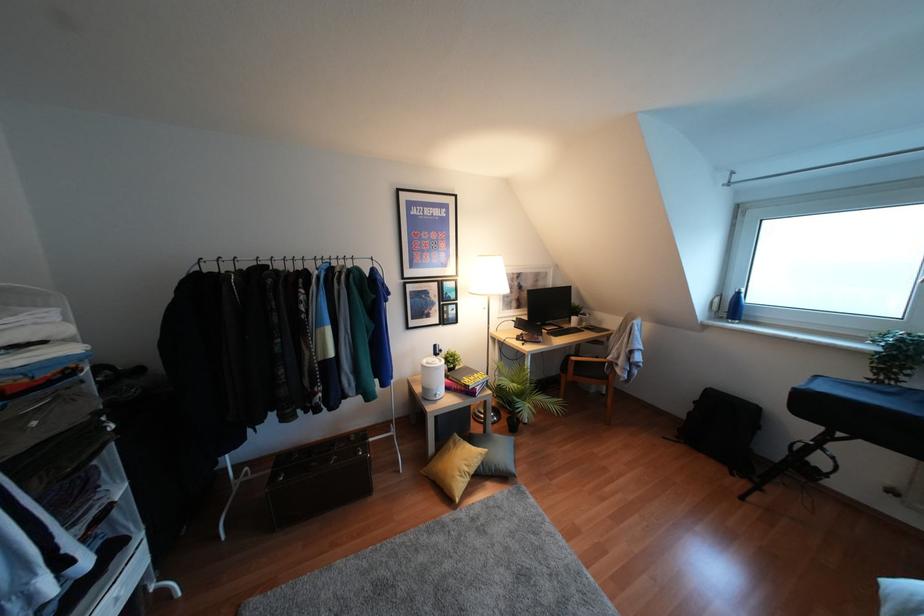
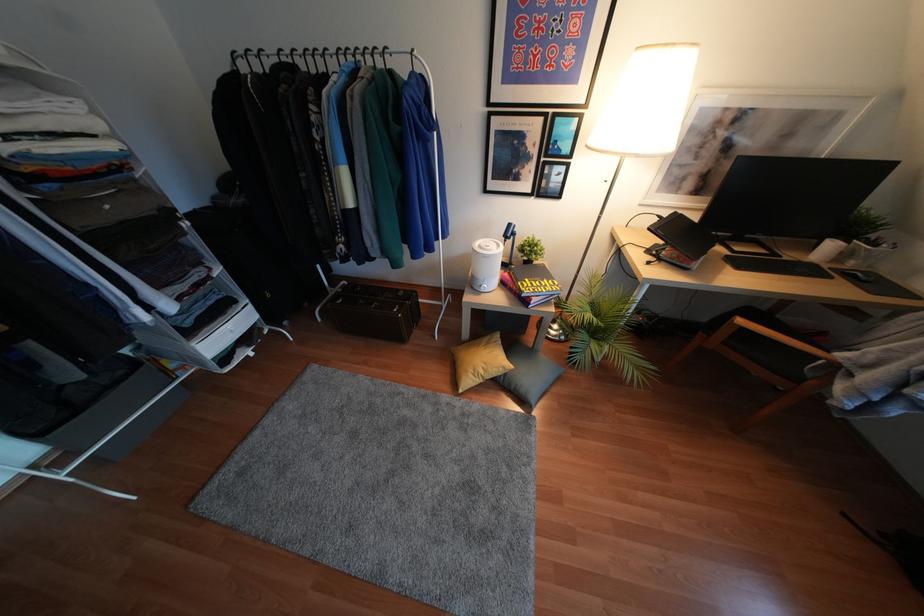
In the second image, find the point that corresponds to point 535,406 in the first image.

(604, 357)